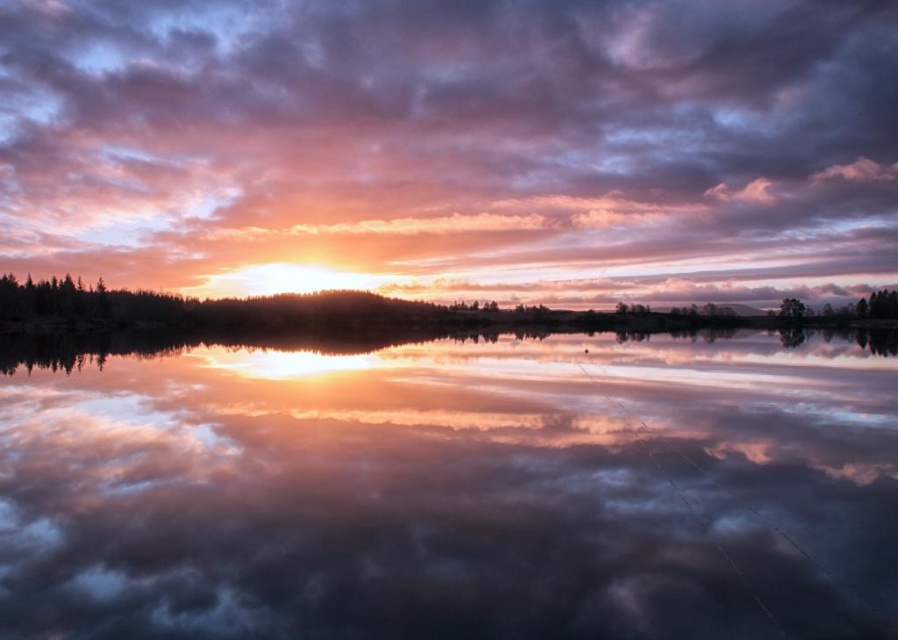
Question: Does green matte trees at center have a lesser width compared to green matte tree at lower right?

Choices:
 (A) no
 (B) yes

Answer: (A)

Question: Which point is closer to the camera taking this photo?

Choices:
 (A) (126, 61)
 (B) (781, 314)
 (C) (20, 392)
 (D) (339, 304)

Answer: (C)

Question: Which of the following is the closest to the observer?

Choices:
 (A) pastel pink cotton clouds at upper center
 (B) reflective water at center

Answer: (B)

Question: Does reflective water at center appear on the right side of green matte tree at lower right?

Choices:
 (A) yes
 (B) no

Answer: (B)

Question: Based on their relative distances, which object is nearer to the pastel pink cotton clouds at upper center?

Choices:
 (A) green matte trees at center
 (B) reflective water at center

Answer: (A)

Question: Is pastel pink cotton clouds at upper center smaller than green matte trees at center?

Choices:
 (A) yes
 (B) no

Answer: (B)